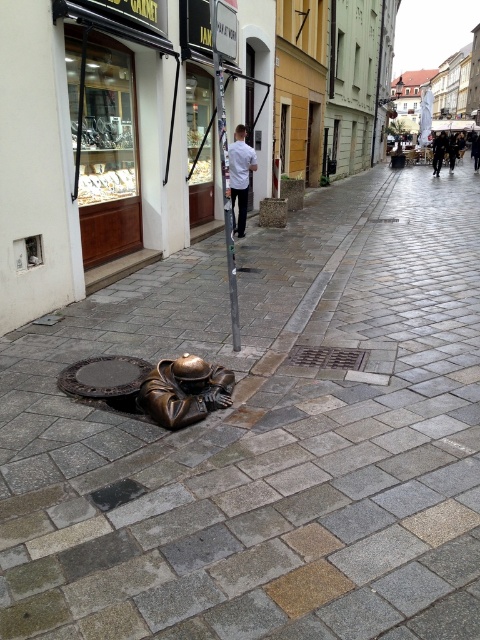
This screenshot has height=640, width=480. Find the location of `dark gray metallic manhole cover at lower left`. dark gray metallic manhole cover at lower left is located at coordinates (104, 376).

Who is positioned more to the left, dark gray metallic manhole cover at lower left or dark gray fabric coat at upper right?

dark gray metallic manhole cover at lower left

Describe the element at coordinates (104, 376) in the screenshot. I see `dark gray metallic manhole cover at lower left` at that location.

You are a GUI agent. You are given a task and a screenshot of the screen. Output one action in this format:
    pyautogui.click(x=<x>, y=<y>)
    Task: Click on the dark gray metallic manhole cover at lower left
    This screenshot has width=480, height=640.
    Given the screenshot: What is the action you would take?
    [x=104, y=376]

Can you confirm if bronze statue at lower center is positioned above white matte shirt at center?

Incorrect, bronze statue at lower center is not positioned above white matte shirt at center.

Is point (193, 401) behind point (236, 150)?

No, (193, 401) is in front of (236, 150).

Does point (184, 376) come farther from viewer compared to point (240, 161)?

No, it is in front of (240, 161).

Locate an element on the screen. The image size is (480, 640). bronze statue at lower center is located at coordinates (184, 390).

Does dark gray metallic manhole cover at lower left have a lesser width compared to white matte shirt at center?

Incorrect, dark gray metallic manhole cover at lower left's width is not less than white matte shirt at center's.

Which is in front, point (139, 372) or point (238, 218)?

Point (139, 372)

Image resolution: width=480 pixels, height=640 pixels. In order to click on dark gray metallic manhole cover at lower left in this screenshot , I will do `click(104, 376)`.